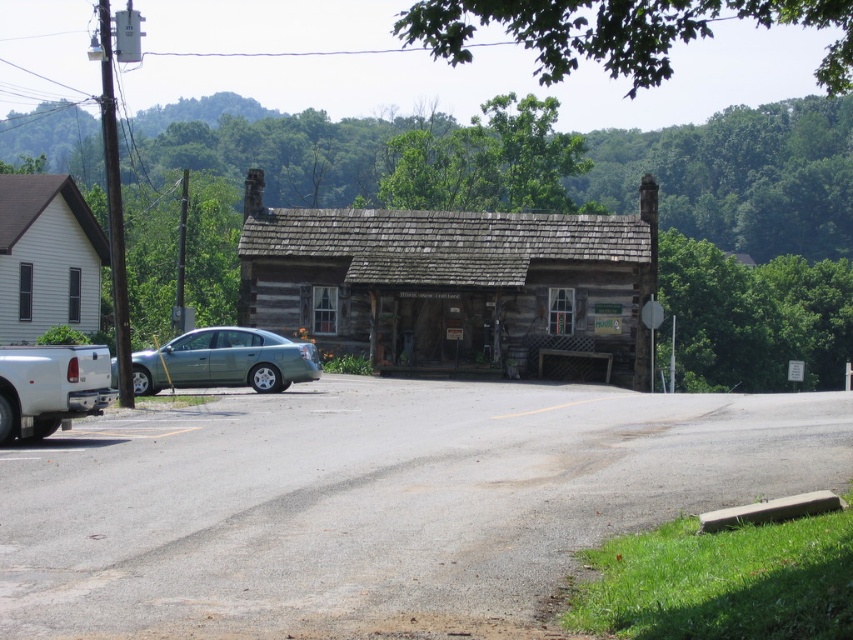
Question: Which is farther from the white wood cabin at left?

Choices:
 (A) green matte sedan at center
 (B) weathered wood log cabin at center

Answer: (B)

Question: Can you confirm if weathered wood log cabin at center is wider than white wood cabin at left?

Choices:
 (A) no
 (B) yes

Answer: (B)

Question: Is weathered wood log cabin at center below white wood cabin at left?

Choices:
 (A) yes
 (B) no

Answer: (B)

Question: Where is white wood cabin at left located in relation to green matte sedan at center in the image?

Choices:
 (A) left
 (B) right

Answer: (A)

Question: Estimate the real-world distances between objects in this image. Which object is farther from the white wood cabin at left?

Choices:
 (A) weathered wood log cabin at center
 (B) green matte sedan at center

Answer: (A)

Question: Which object is farther from the camera taking this photo?

Choices:
 (A) white wood cabin at left
 (B) weathered wood log cabin at center

Answer: (B)